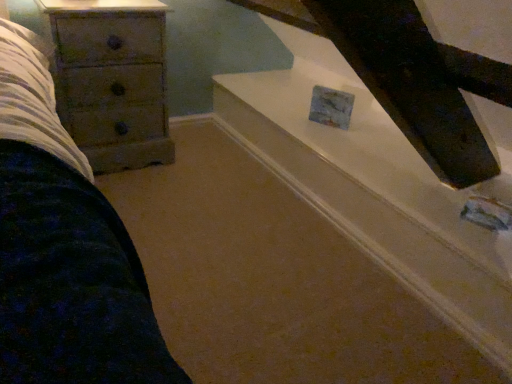
Question: In the image, is wooden chest of drawers at left on the left side or the right side of white glossy stairwell at upper center?

Choices:
 (A) right
 (B) left

Answer: (B)

Question: From the image's perspective, is wooden chest of drawers at left above or below white glossy stairwell at upper center?

Choices:
 (A) below
 (B) above

Answer: (B)

Question: In the image, is wooden chest of drawers at left positioned in front of or behind white glossy stairwell at upper center?

Choices:
 (A) front
 (B) behind

Answer: (B)

Question: Looking at their shapes, would you say white glossy stairwell at upper center is wider or thinner than wooden chest of drawers at left?

Choices:
 (A) wide
 (B) thin

Answer: (A)

Question: Is white glossy stairwell at upper center to the left or to the right of wooden chest of drawers at left in the image?

Choices:
 (A) left
 (B) right

Answer: (B)

Question: Considering the positions of white glossy stairwell at upper center and wooden chest of drawers at left in the image, is white glossy stairwell at upper center taller or shorter than wooden chest of drawers at left?

Choices:
 (A) tall
 (B) short

Answer: (B)

Question: In the image, is white glossy stairwell at upper center positioned in front of or behind wooden chest of drawers at left?

Choices:
 (A) front
 (B) behind

Answer: (A)